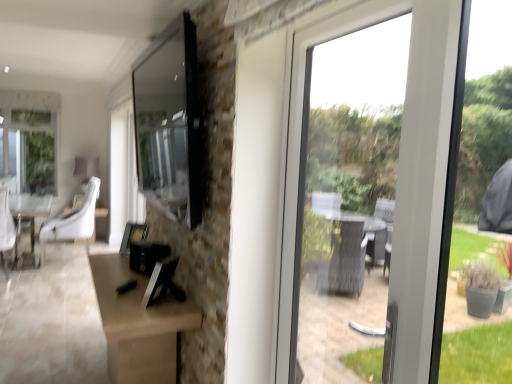
Question: Considering the positions of white leather swivel chair at left and matte black tv at upper center in the image, is white leather swivel chair at left bigger or smaller than matte black tv at upper center?

Choices:
 (A) big
 (B) small

Answer: (B)

Question: Is white leather swivel chair at left taller or shorter than matte black tv at upper center?

Choices:
 (A) short
 (B) tall

Answer: (B)

Question: Estimate the real-world distances between objects in this image. Which object is closer to the white leather swivel chair at left?

Choices:
 (A) white fabric chair at center
 (B) matte black tv at upper center

Answer: (A)

Question: Considering the real-world distances, which object is farthest from the matte black tv at upper center?

Choices:
 (A) white fabric chair at center
 (B) white leather swivel chair at left

Answer: (B)